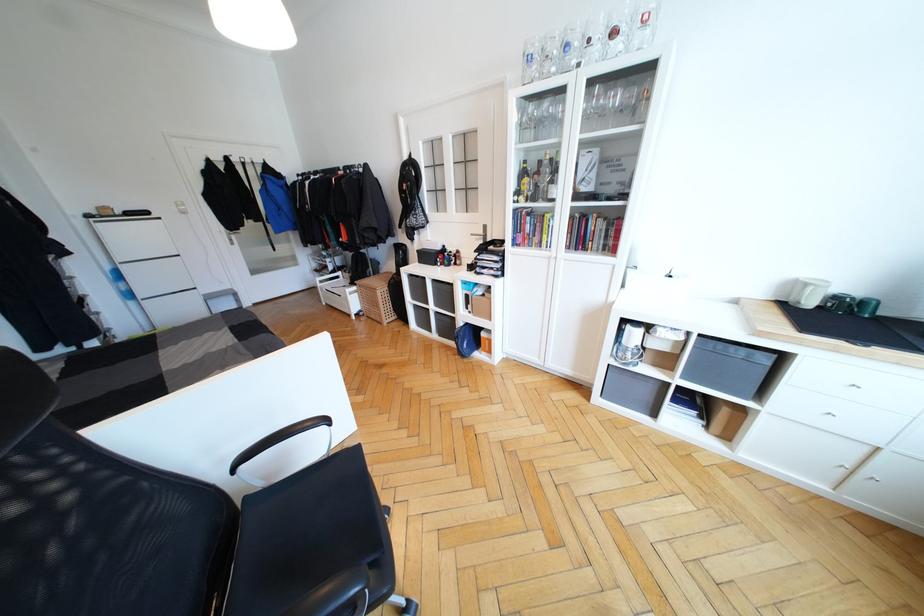
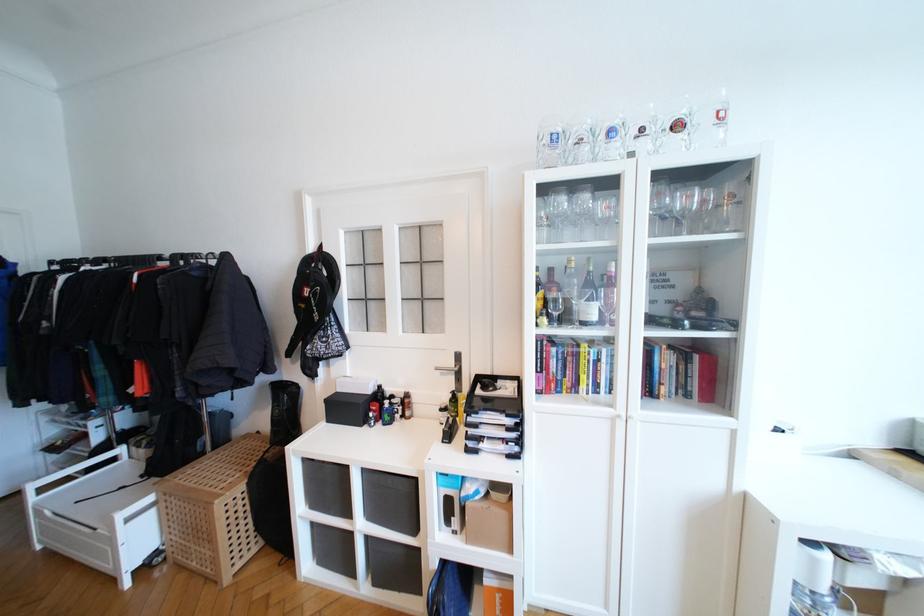
Find the pixel in the second image that matches point (532, 195) in the first image.

(558, 315)